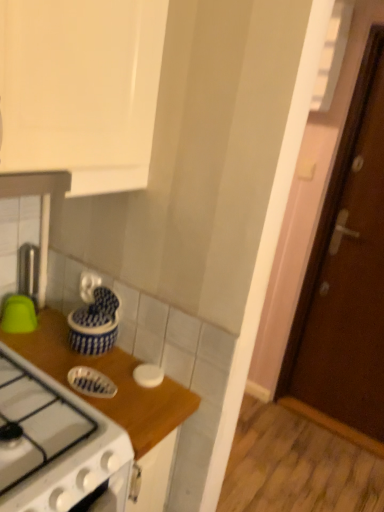
I want to click on vacant area on top of wooden at upper right (from a real-world perspective), so click(89, 362).